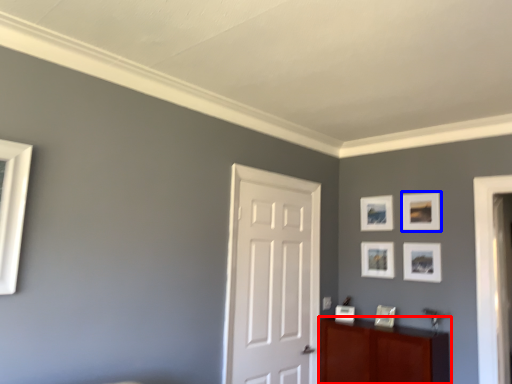
Question: Which of the following is the closest to the observer, cabinetry (highlighted by a red box) or picture frame (highlighted by a blue box)?

Choices:
 (A) cabinetry
 (B) picture frame

Answer: (A)